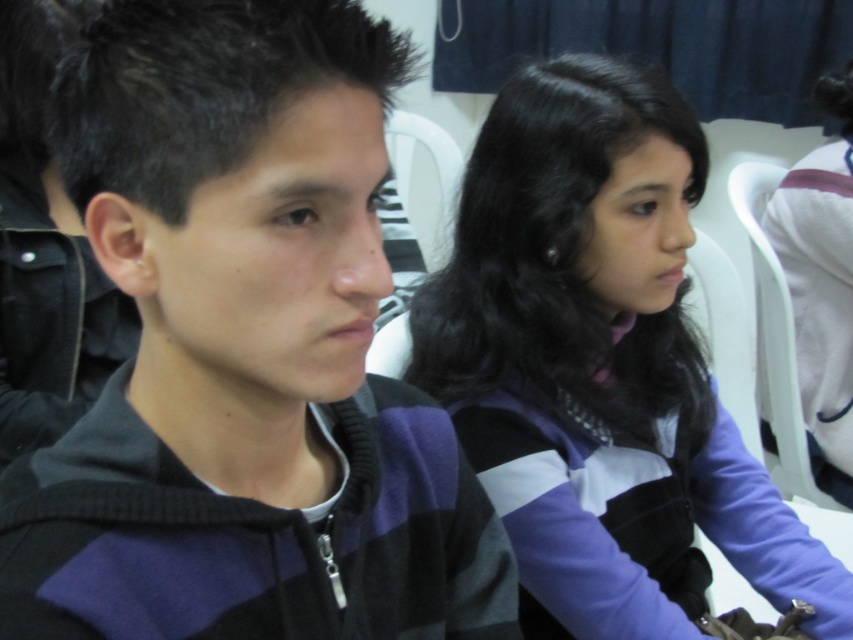
Which of these two, black striped sweater at center or purple striped sweater at center, stands taller?

Standing taller between the two is purple striped sweater at center.

Which is above, black striped sweater at center or purple striped sweater at center?

purple striped sweater at center is higher up.

This screenshot has height=640, width=853. I want to click on black striped sweater at center, so click(x=244, y=353).